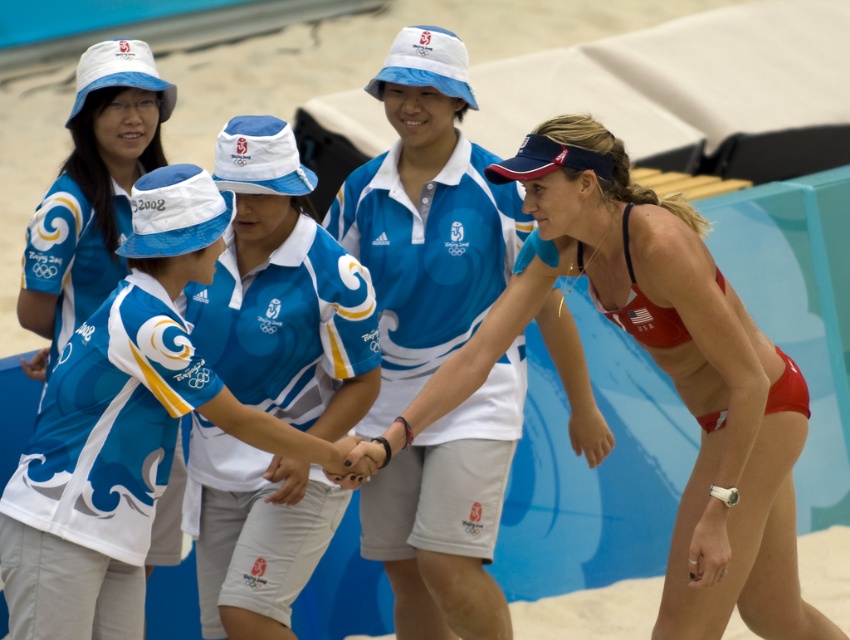
Does white fabric uniform at center have a greater width compared to light blue fabric shirt at center?

Correct, the width of white fabric uniform at center exceeds that of light blue fabric shirt at center.

Who is shorter, white fabric uniform at center or light blue fabric shirt at center?

With less height is light blue fabric shirt at center.

Who is more forward, (166, 465) or (76, 314)?

Point (166, 465) is in front.

This screenshot has height=640, width=850. What are the coordinates of `white fabric uniform at center` in the screenshot? It's located at (106, 442).

Does point (233, 276) come closer to viewer compared to point (506, 218)?

Yes, it is.

Which is in front, point (309, 275) or point (378, 164)?

Point (309, 275)

Identify the location of blue and white jersey at center. This screenshot has width=850, height=640. (287, 324).

Between matte red bikini at center and light blue fabric shirt at center, which one has less height?

light blue fabric shirt at center

Measure the distance between matte red bikini at center and camera.

matte red bikini at center and camera are 4.86 meters apart.

You are a GUI agent. You are given a task and a screenshot of the screen. Output one action in this format:
    pyautogui.click(x=<x>, y=<y>)
    Task: Click on the matte red bikini at center
    The width and height of the screenshot is (850, 640).
    Given the screenshot: What is the action you would take?
    666,372